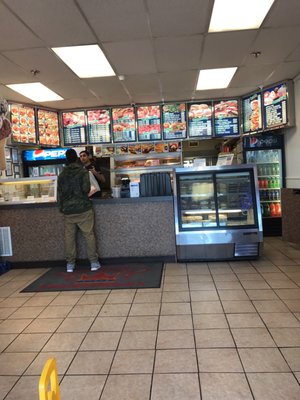
Locate an element on the screen. The height and width of the screenshot is (400, 300). wall is located at coordinates (x=292, y=146), (x=3, y=174).